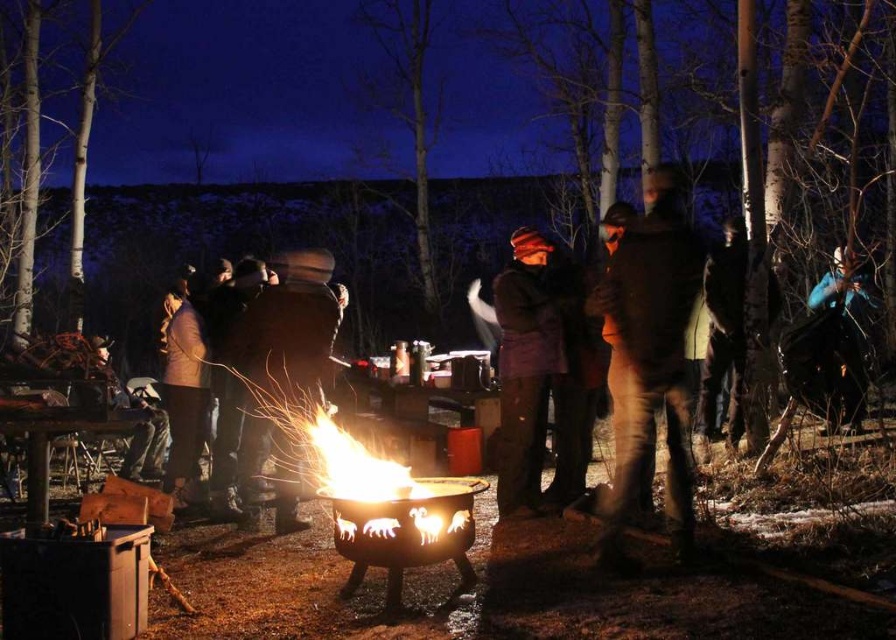
Question: Which point is farther from the camera taking this photo?

Choices:
 (A) (231, 342)
 (B) (362, 458)

Answer: (A)

Question: Among these objects, which one is nearest to the camera?

Choices:
 (A) brown fuzzy jacket at center
 (B) dark brown leather jacket at center

Answer: (A)

Question: Does brown fuzzy jacket at center appear over dark brown leather jacket at center?

Choices:
 (A) yes
 (B) no

Answer: (A)

Question: Is brown fuzzy jacket at center to the right of metallic fire pit at center from the viewer's perspective?

Choices:
 (A) no
 (B) yes

Answer: (B)

Question: Which point is closer to the camera?

Choices:
 (A) metallic fire pit at center
 (B) brown fuzzy jacket at center
 (C) blue fabric jacket at right
 (D) dark brown leather jacket at center

Answer: (A)

Question: Can you confirm if brown fuzzy jacket at center is positioned below metallic fire pit at center?

Choices:
 (A) no
 (B) yes

Answer: (A)